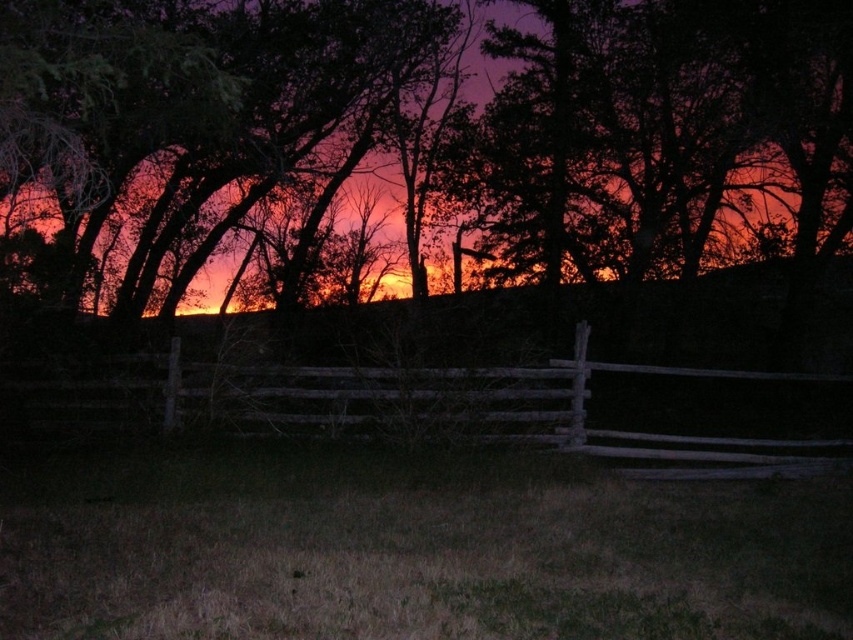
You are a painter standing in front of the dark brown wood fence at center and the weathered wood fence at center. You want to paint both fences but need to know which one is taller. Which fence should you look up more to paint?

The dark brown wood fence at center is taller than the weathered wood fence at center, so you should look up more to paint the dark brown wood fence at center.

From the picture: You are standing in the middle of a field looking at the dark brown wood fence at center and the weathered wood fence at center. Which fence is closer to you?

The dark brown wood fence at center is closer to you because it is in front of the weathered wood fence at center.

You are a painter standing in the middle of the field. You want to paint the fences in the scene. Which fence, the dark brown wood fence at center or the weathered wood fence at center, should you focus on first if you want to paint the wider one?

The dark brown wood fence at center should be painted first because it has a larger width than the weathered wood fence at center.